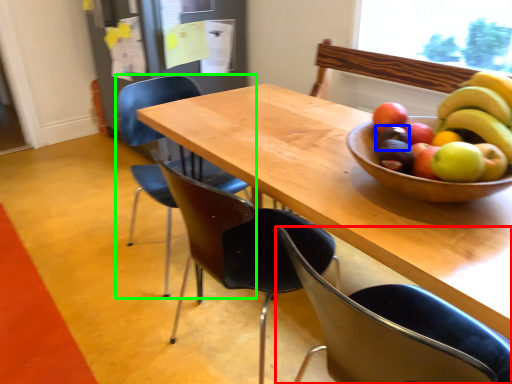
Question: Based on their relative distances, which object is nearer to chair (highlighted by a red box)? Choose from avocado (highlighted by a blue box) and chair (highlighted by a green box).

Choices:
 (A) avocado
 (B) chair

Answer: (A)